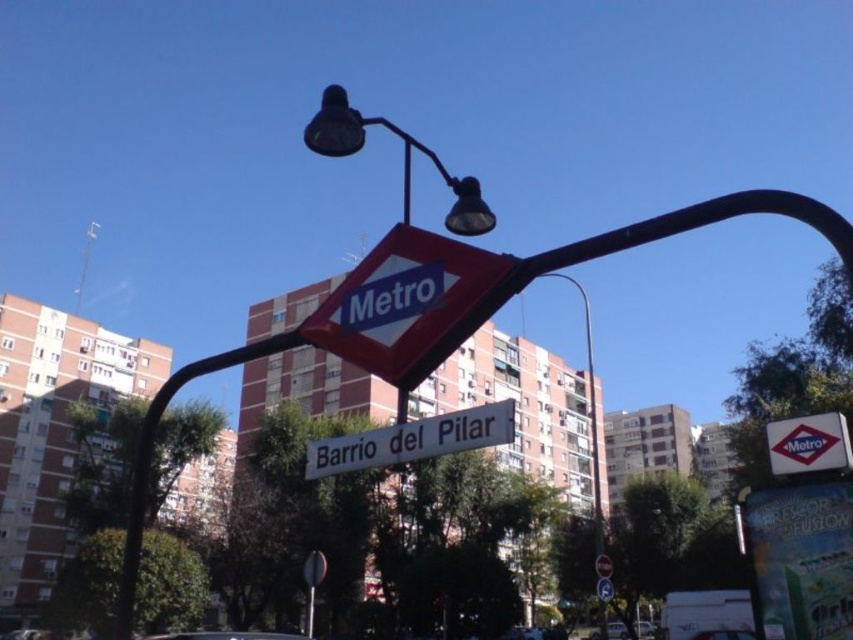
You are a delivery drone flying at an altitude of 100 meters. You need to deliver a package to the metallic streetlight at center. The blue plastic metro sign at upper center is in your path. Can you safely navigate around the sign without colliding?

The blue plastic metro sign at upper center is 63.93 meters away from the metallic streetlight at center. Since the drone is flying at 100 meters altitude, it can safely navigate around the sign as it is much higher than the sign and streetlight, avoiding collision.